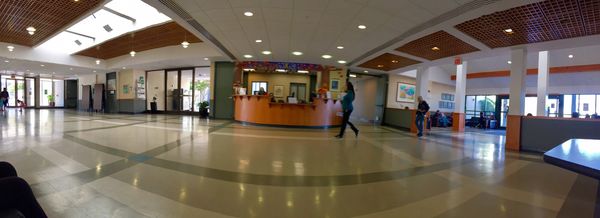
Locate an element on the screen. The image size is (600, 218). doorway is located at coordinates (9, 95), (172, 95), (505, 107), (553, 110).